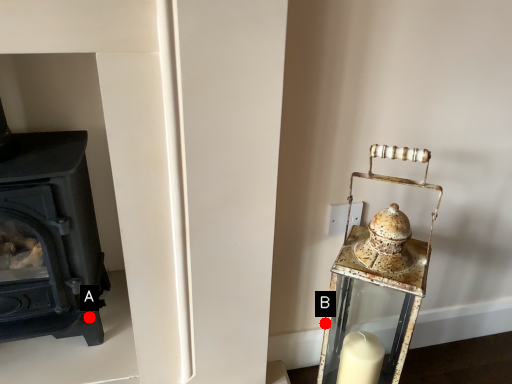
Question: Two points are circled on the image, labeled by A and B beside each circle. Which point is closer to the camera taking this photo?

Choices:
 (A) A is closer
 (B) B is closer

Answer: (B)